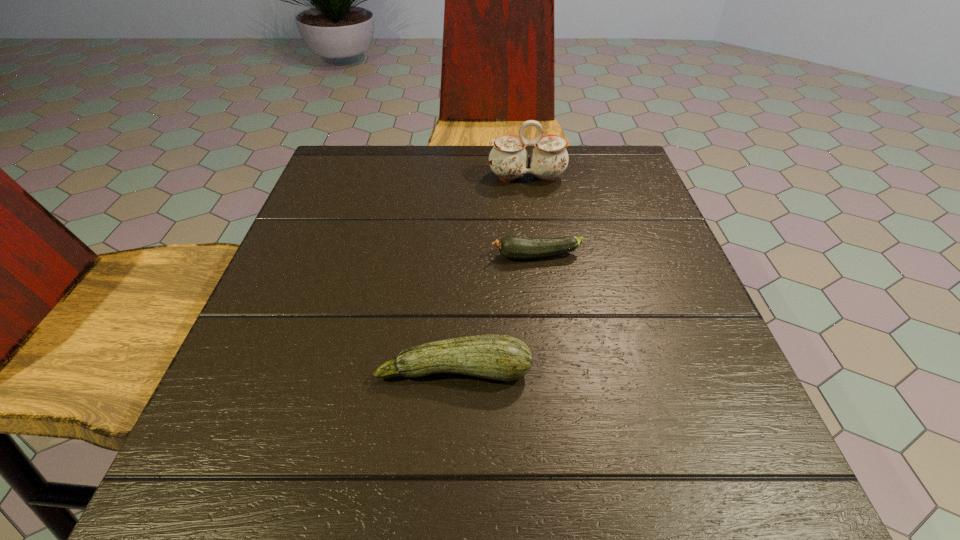
At what (x,y) coordinates should I click in order to perform the action: click on object that can be found as the closest to the farther zucchini. Please return your answer as a coordinate pair (x, y). This screenshot has width=960, height=540. Looking at the image, I should click on (501, 357).

Identify the location of free space that satisfies the following two spatial constraints: 1. by the handle of the chinaware; 2. at the blossom end of the shortest object. (538, 256).

You are a GUI agent. You are given a task and a screenshot of the screen. Output one action in this format:
    pyautogui.click(x=<x>, y=<y>)
    Task: Click on the blank area in the image that satisfies the following two spatial constraints: 1. by the handle of the farthest object; 2. at the blossom end of the second nearest object
    This screenshot has height=540, width=960.
    Given the screenshot: What is the action you would take?
    pyautogui.click(x=538, y=256)

What are the coordinates of `free space that satisfies the following two spatial constraints: 1. at the blossom end of the shorter zucchini; 2. at the stem end of the nearest object` in the screenshot? It's located at (552, 370).

The image size is (960, 540). Identify the location of free region that satisfies the following two spatial constraints: 1. at the blossom end of the shortest object; 2. at the stem end of the taller zucchini. (552, 370).

Find the location of `free location that satisfies the following two spatial constraints: 1. by the handle of the chinaware; 2. at the blossom end of the second farthest object`. free location that satisfies the following two spatial constraints: 1. by the handle of the chinaware; 2. at the blossom end of the second farthest object is located at coordinates (538, 256).

Where is `vacant point that satisfies the following two spatial constraints: 1. at the blossom end of the second farthest object; 2. at the stem end of the nearer zucchini`? The image size is (960, 540). vacant point that satisfies the following two spatial constraints: 1. at the blossom end of the second farthest object; 2. at the stem end of the nearer zucchini is located at coordinates (552, 370).

Where is `free location that satisfies the following two spatial constraints: 1. at the blossom end of the shortest object; 2. at the stem end of the nearer zucchini`? Image resolution: width=960 pixels, height=540 pixels. free location that satisfies the following two spatial constraints: 1. at the blossom end of the shortest object; 2. at the stem end of the nearer zucchini is located at coordinates (552, 370).

The height and width of the screenshot is (540, 960). I want to click on free space that satisfies the following two spatial constraints: 1. by the handle of the farthest object; 2. at the blossom end of the second farthest object, so click(x=538, y=256).